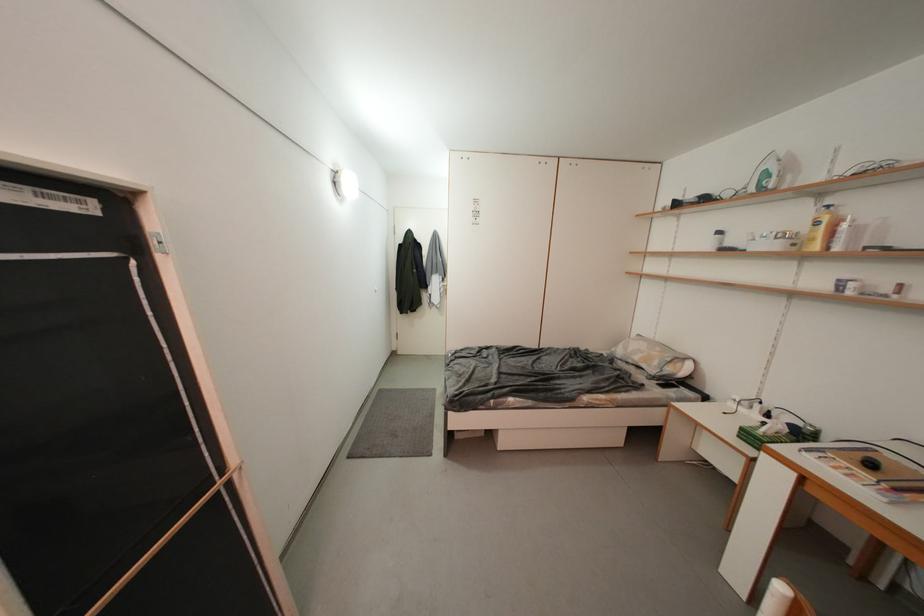
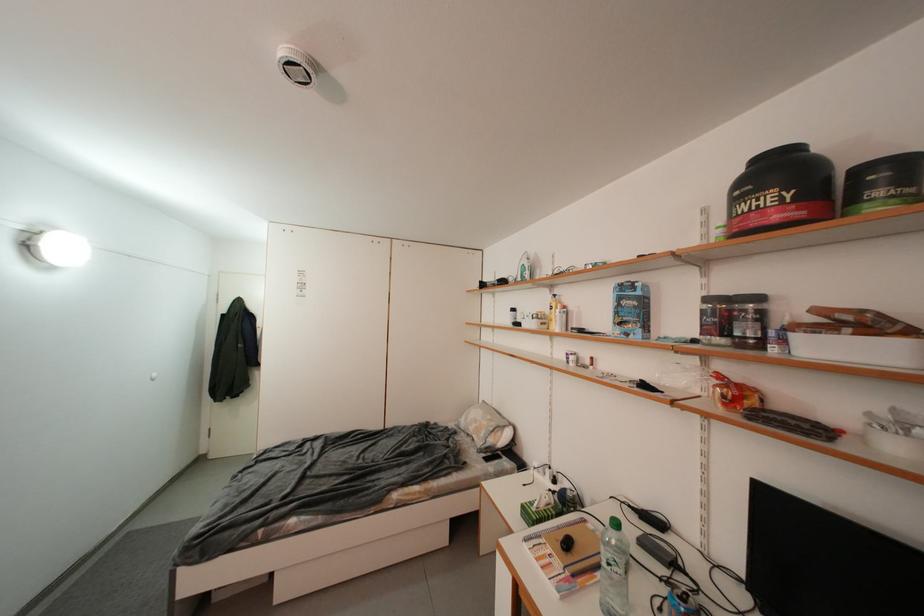
Question: In a continuous first-person perspective shot, in which direction is the camera moving?

Choices:
 (A) Left
 (B) Right
 (C) Forward
 (D) Backward

Answer: (B)